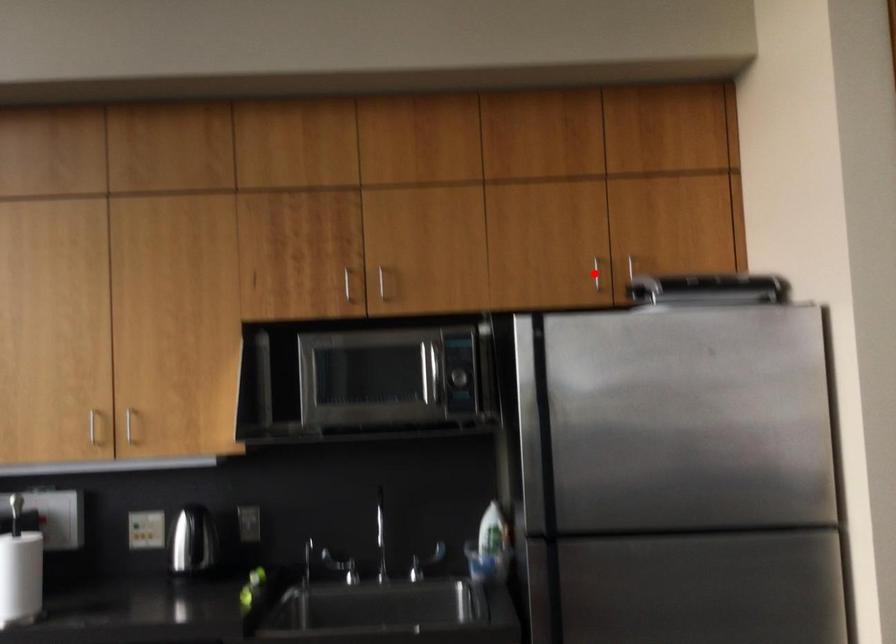
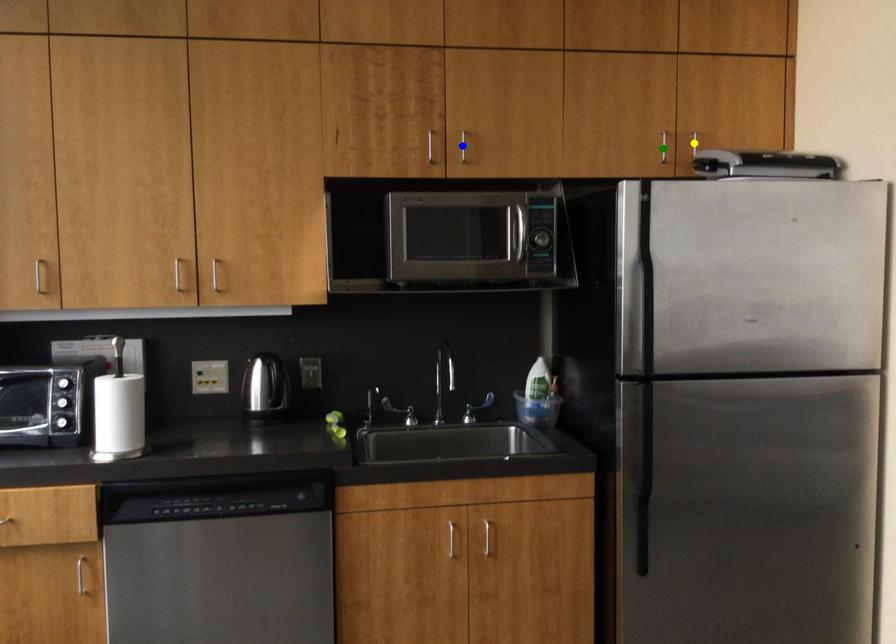
Question: I am providing you with two images of the same scene from different viewpoints. A red point is marked on the first image. You are given multiple points on the second image. Which mark in image 2 goes with the point in image 1?

Choices:
 (A) green point
 (B) yellow point
 (C) blue point

Answer: (A)